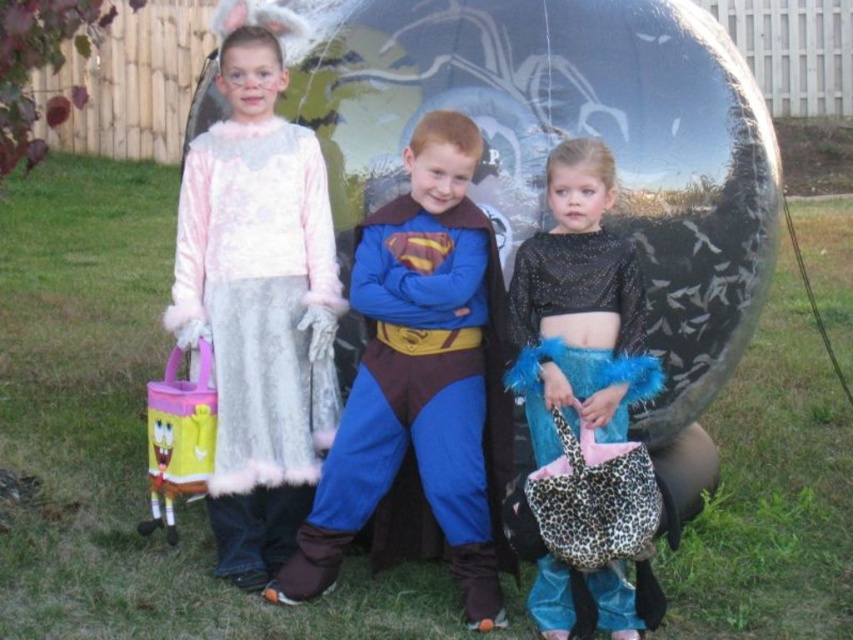
You are a photographer trying to capture a photo of the glossy black sphere at center and the sparkly black top at center. Which object should you focus on first if you want to ensure both are in the frame without moving the camera?

You should focus on the glossy black sphere at center first because it is positioned on the left side of the sparkly black top at center, so adjusting the frame to include both would require ensuring the leftmost object is within the camera view first.